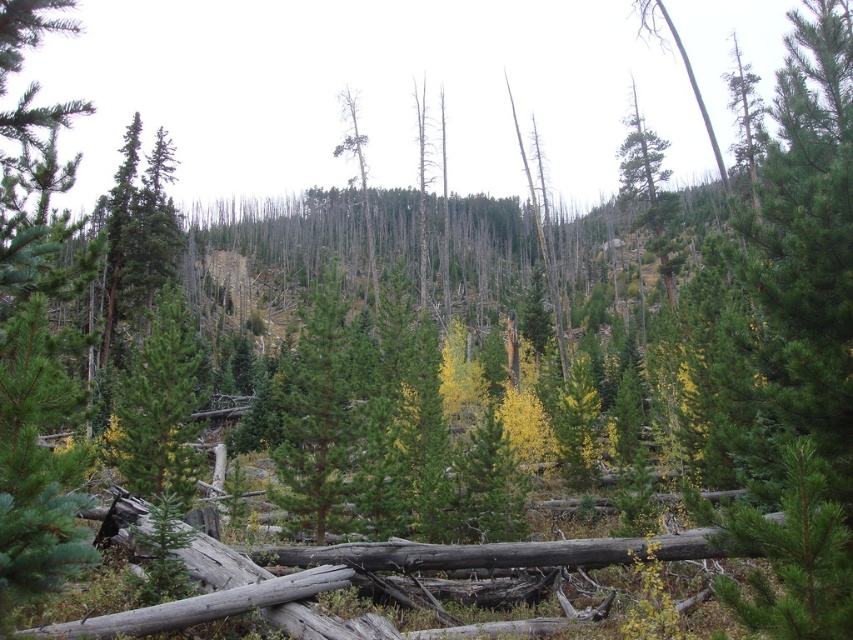
You are navigating through the forest and want to move from your current position to a destination. You see two points marked in the scene. Which point is closer to you, point [337,337] or point [339,97]?

Point [337,337] is in front of point [339,97], so it is closer to you.

You are a hiker navigating through a forest and notice a green matte tree at center and a dead wood at center. Which object is positioned lower in the scene?

The green matte tree at center is located below dead wood at center, so it is positioned lower in the scene.

You are navigating through a forest and come across a green matte tree at center. Based on its position, can you determine if it is closer to the foreground or midground of the scene?

The green matte tree at center is located at point 0.650 on the x and 0.370 on the y coordinate. Since the midground is typically positioned between the foreground and background in an image, the tree is likely in the midground.